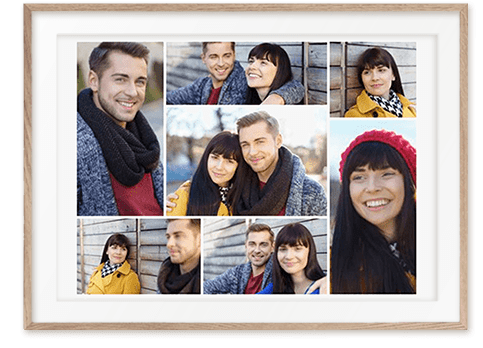
Where is `photographs`? photographs is located at coordinates (220, 78), (138, 125), (261, 165), (369, 66), (369, 192), (251, 276), (132, 270).